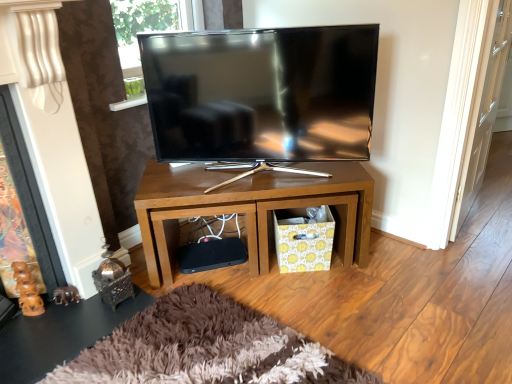
Question: Is point (16, 139) positioned closer to the camera than point (67, 319)?

Choices:
 (A) closer
 (B) farther

Answer: (A)

Question: From a real-world perspective, relative to shiny metallic side table at lower left, is brown wood fireplace at left vertically above or below?

Choices:
 (A) above
 (B) below

Answer: (A)

Question: Which object is positioned farthest from the wooden tv stand at center?

Choices:
 (A) polished metal lantern at lower left
 (B) transparent glass door at right
 (C) shiny metallic side table at lower left
 (D) brown wood fireplace at left
 (E) yellow floral cardboard crate at lower center

Answer: (B)

Question: Which is nearer to the brown wood fireplace at left?

Choices:
 (A) polished metal lantern at lower left
 (B) transparent glass door at right
 (C) matte black tv at center
 (D) yellow floral cardboard crate at lower center
 (E) shiny metallic side table at lower left

Answer: (E)